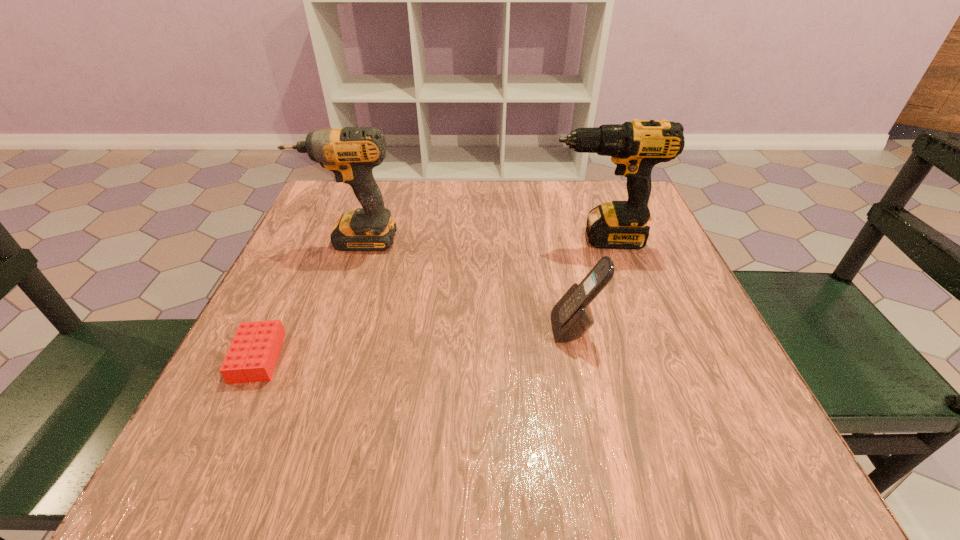
The image size is (960, 540). I want to click on blank space located on the right of the shortest object, so click(x=404, y=357).

This screenshot has height=540, width=960. In order to click on drill that is at the left edge in this screenshot , I will do `click(351, 153)`.

In order to click on Lego that is at the left edge in this screenshot , I will do click(x=252, y=356).

Locate an element on the screen. This screenshot has width=960, height=540. object present at the right edge is located at coordinates (635, 147).

At what (x,y) coordinates should I click in order to perform the action: click on object that is at the far left corner. Please return your answer as a coordinate pair (x, y). Image resolution: width=960 pixels, height=540 pixels. Looking at the image, I should click on (351, 153).

Where is `object present at the far right corner`? This screenshot has width=960, height=540. object present at the far right corner is located at coordinates coord(635,147).

In the image, there is a desktop. At what (x,y) coordinates should I click in order to perform the action: click on free space at the far edge. Please return your answer as a coordinate pair (x, y). The width and height of the screenshot is (960, 540). Looking at the image, I should click on (468, 228).

In the image, there is a desktop. At what (x,y) coordinates should I click in order to perform the action: click on vacant space at the near edge. Please return your answer as a coordinate pair (x, y). The image size is (960, 540). Looking at the image, I should click on (624, 467).

The width and height of the screenshot is (960, 540). In the image, there is a desktop. In order to click on free space at the left edge in this screenshot , I will do `click(271, 389)`.

The width and height of the screenshot is (960, 540). What are the coordinates of `vacant space at the right edge of the desktop` in the screenshot? It's located at (720, 347).